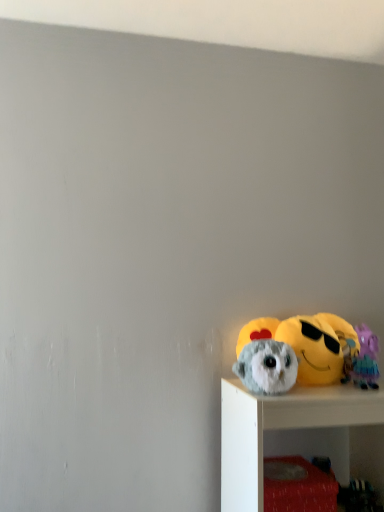
Question: From a real-world perspective, is purple plush toy at right, which is the third toy in left-to-right order, physically located above or below fluffy gray plush at lower right, the third toy positioned from the right?

Choices:
 (A) below
 (B) above

Answer: (B)

Question: Considering the positions of purple plush toy at right, which is the third toy in left-to-right order, and fluffy gray plush at lower right, the third toy positioned from the right, in the image, is purple plush toy at right, which is the third toy in left-to-right order, taller or shorter than fluffy gray plush at lower right, the third toy positioned from the right,?

Choices:
 (A) short
 (B) tall

Answer: (B)

Question: Estimate the real-world distances between objects in this image. Which object is farther from the fluffy gray plush at lower right, positioned as the first toy in left-to-right order?

Choices:
 (A) purple plush toy at right, the first toy positioned from the right
 (B) fluffy gray owl at lower right, the second toy when ordered from right to left

Answer: (A)

Question: Which object is positioned closest to the fluffy gray owl at lower right, which is counted as the second toy, starting from the left?

Choices:
 (A) fluffy gray plush at lower right, positioned as the first toy in left-to-right order
 (B) purple plush toy at right, the first toy positioned from the right

Answer: (B)